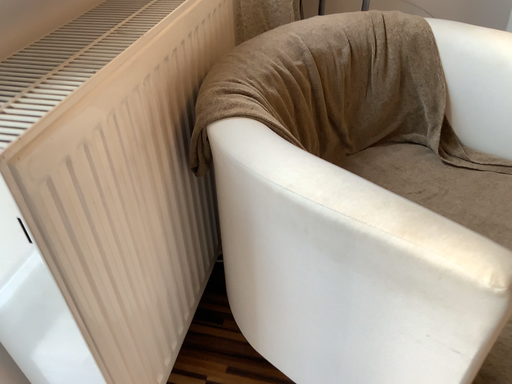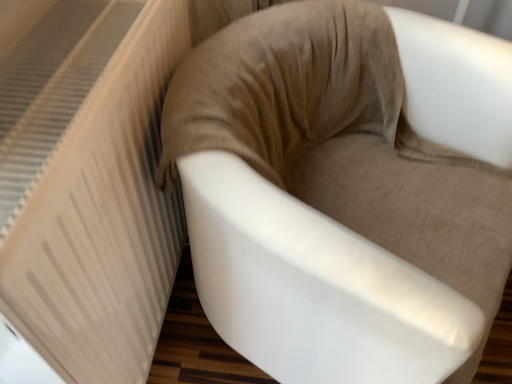
Question: Which way did the camera rotate in the video?

Choices:
 (A) rotated upward
 (B) rotated downward

Answer: (B)